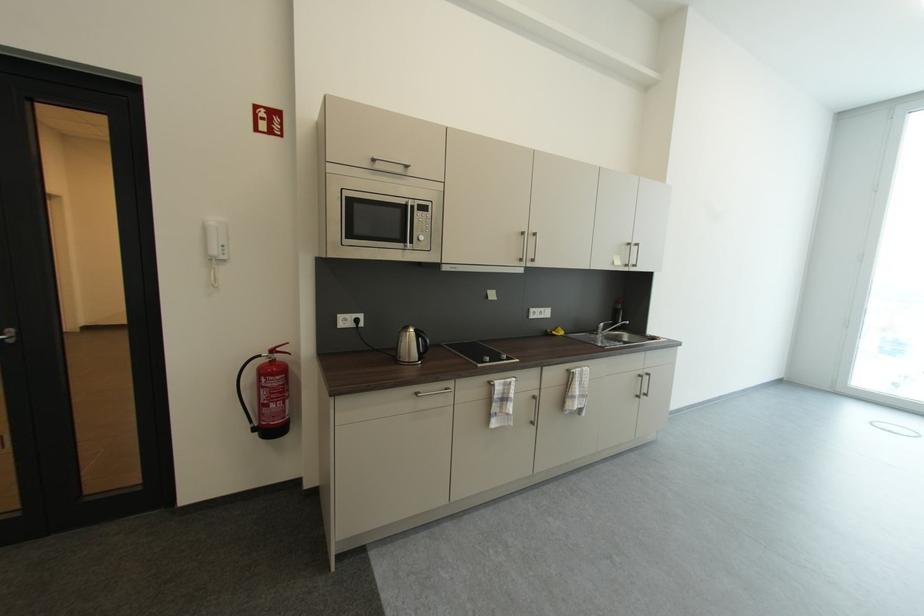
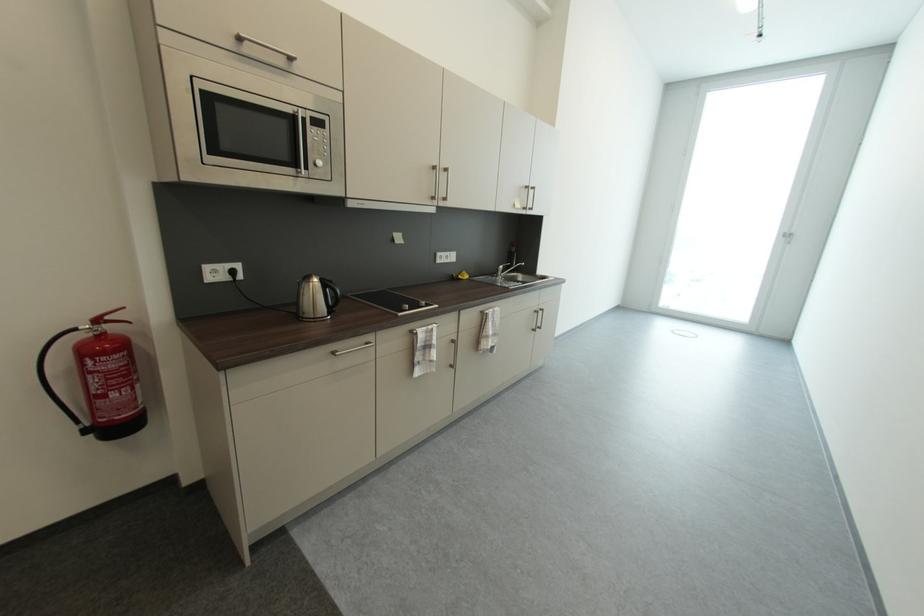
In the second image, find the point that corresponds to point (415, 334) in the first image.

(317, 285)